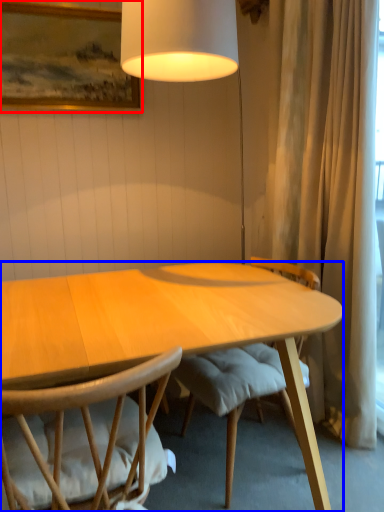
Question: Which object appears closest to the camera in this image, picture frame (highlighted by a red box) or desk (highlighted by a blue box)?

Choices:
 (A) picture frame
 (B) desk

Answer: (B)